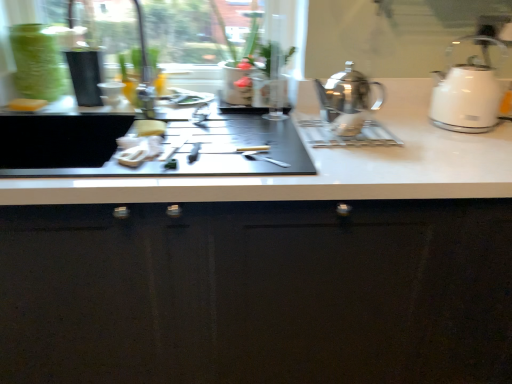
Identify the location of vacant point above glossy black cabinet at center (from a real-world perspective). The width and height of the screenshot is (512, 384). (289, 142).